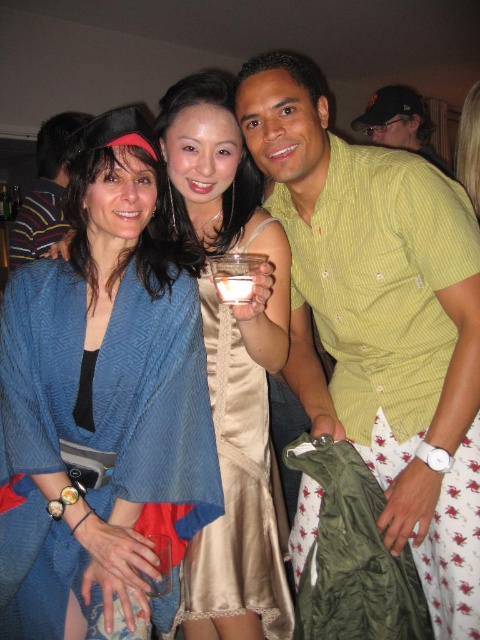
Question: Considering the real-world distances, which object is closest to the blue cotton robe at left?

Choices:
 (A) translucent glass cup at center
 (B) green striped shirt at center

Answer: (B)

Question: Is green striped shirt at upper right in front of clear plastic cup at center?

Choices:
 (A) yes
 (B) no

Answer: (B)

Question: Which of the following is the closest to the observer?

Choices:
 (A) translucent glass cup at center
 (B) blue textured kimono at left
 (C) green striped shirt at upper right
 (D) blue cotton robe at left

Answer: (A)

Question: Is green striped shirt at center in front of translucent glass cup at center?

Choices:
 (A) no
 (B) yes

Answer: (A)

Question: Is blue textured kimono at left wider than translucent glass cup at center?

Choices:
 (A) no
 (B) yes

Answer: (B)

Question: Which of the following is the closest to the observer?

Choices:
 (A) (21, 262)
 (B) (220, 280)
 (C) (63, 193)
 (D) (264, 228)

Answer: (B)